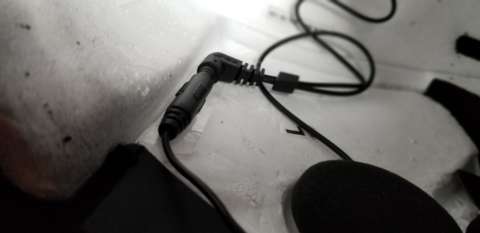
Locate an element on the screen. charging disk is located at coordinates (355, 193).